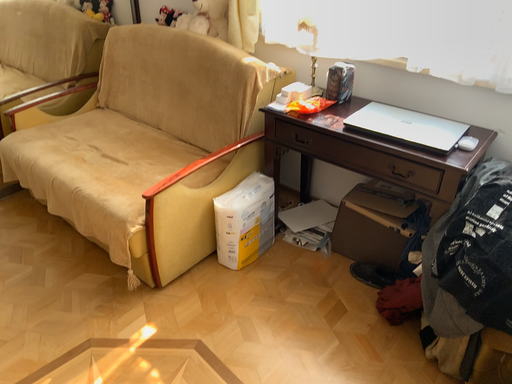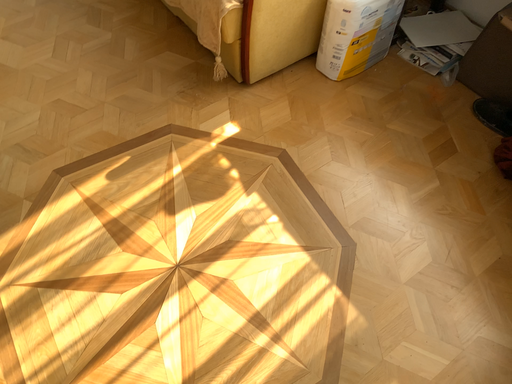
Question: How did the camera likely rotate when shooting the video?

Choices:
 (A) rotated left
 (B) rotated right

Answer: (A)